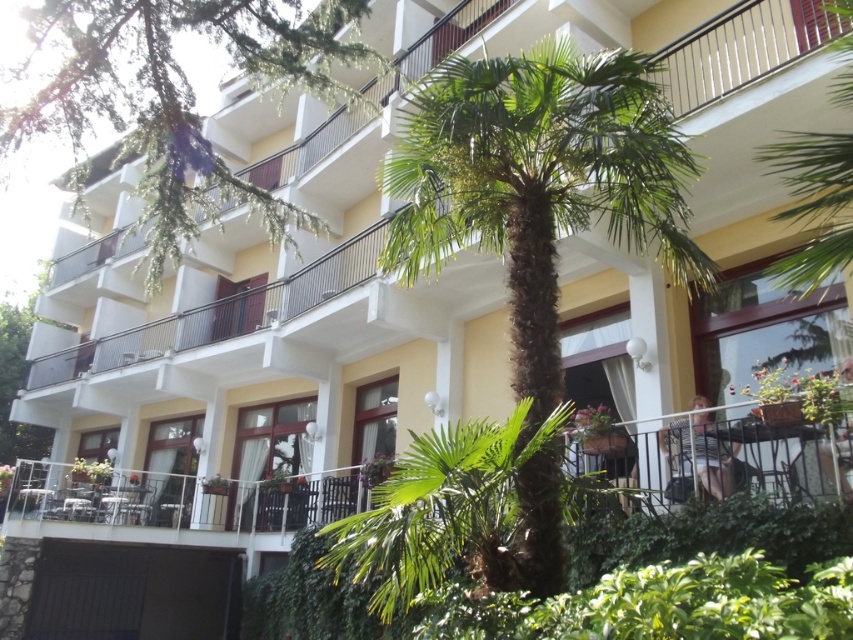
Question: Which of the following is the farthest from the observer?

Choices:
 (A) green leafy palm tree at center
 (B) green leafy tree at upper left

Answer: (B)

Question: Which point appears farthest from the camera in this image?

Choices:
 (A) (459, 131)
 (B) (148, 276)

Answer: (B)

Question: In this image, where is green leafy palm tree at center located relative to green leafy tree at upper left?

Choices:
 (A) below
 (B) above

Answer: (A)

Question: Does green leafy palm tree at center come behind green leafy tree at upper left?

Choices:
 (A) yes
 (B) no

Answer: (B)

Question: Does green leafy palm tree at center appear under green leafy tree at upper left?

Choices:
 (A) yes
 (B) no

Answer: (A)

Question: Which of the following is the closest to the observer?

Choices:
 (A) green leafy palm tree at center
 (B) green leafy tree at upper left

Answer: (A)